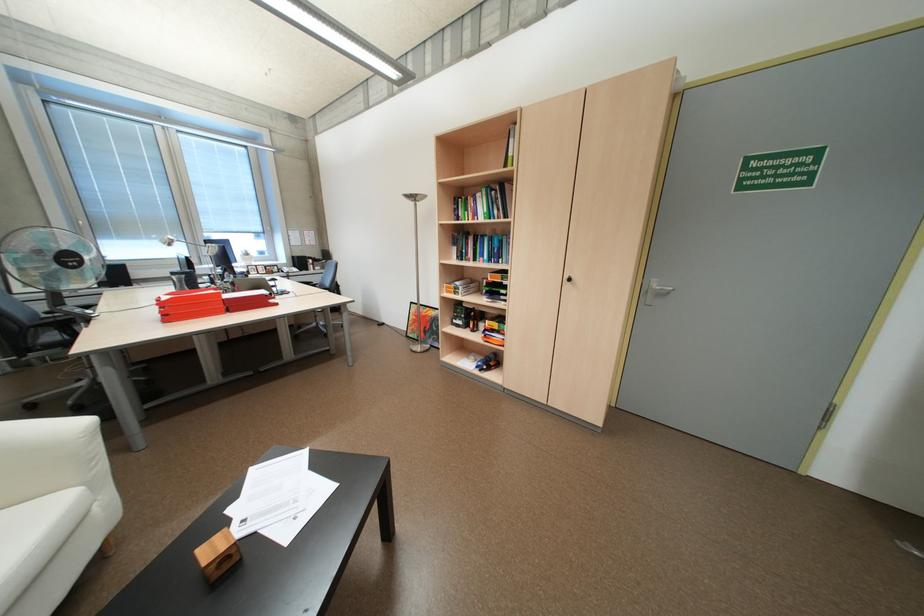
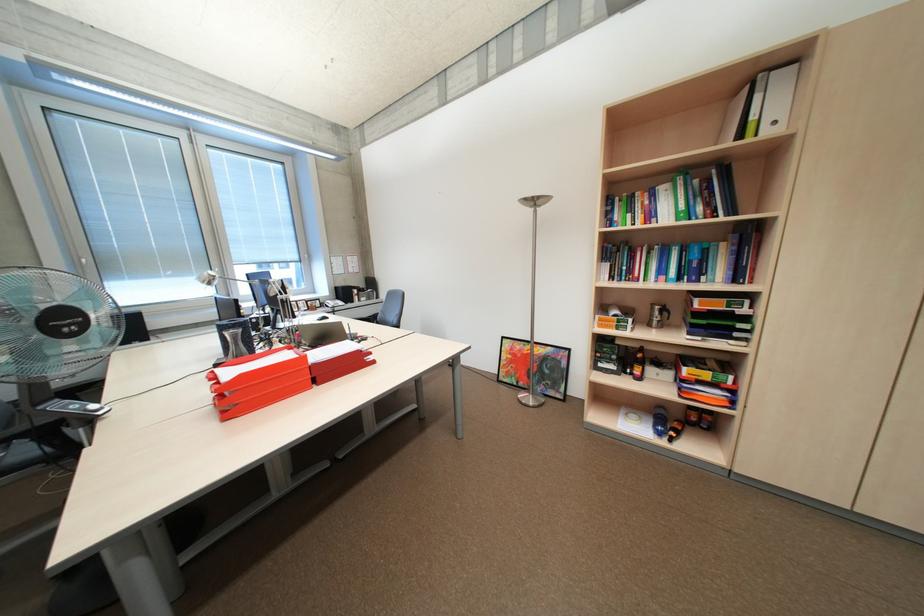
The point at (505, 244) is marked in the first image. Where is the corresponding point in the second image?

(704, 254)